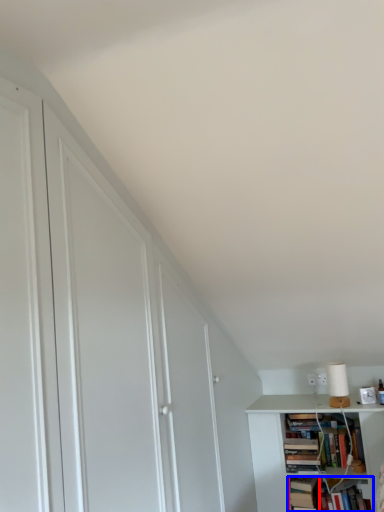
Question: Which object appears farthest to the camera in this image, book (highlighted by a red box) or book (highlighted by a blue box)?

Choices:
 (A) book
 (B) book

Answer: (A)